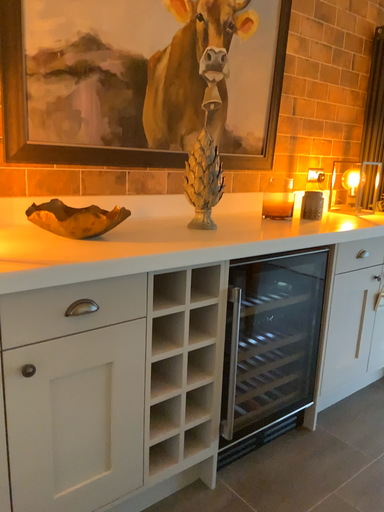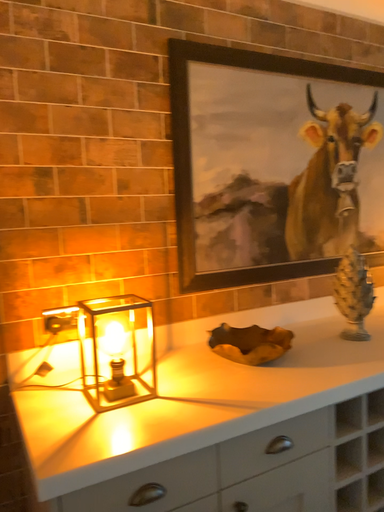
Question: Which way did the camera rotate in the video?

Choices:
 (A) rotated left
 (B) rotated right

Answer: (A)